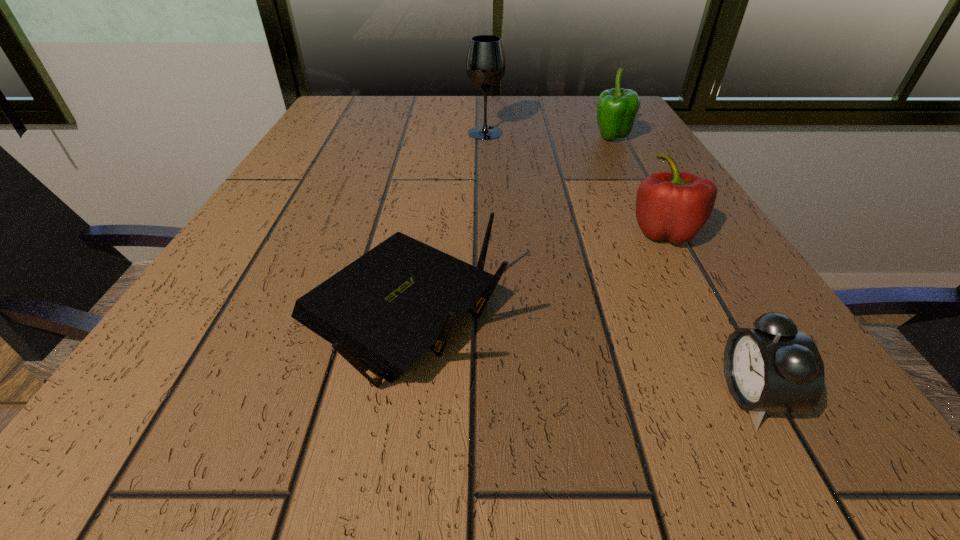
This screenshot has height=540, width=960. I want to click on object identified as the closest to the alarm clock, so click(675, 206).

This screenshot has width=960, height=540. In order to click on free space in the image that satisfies the following two spatial constraints: 1. on the back side of the second tallest object; 2. on the left side of the router in this screenshot , I will do `click(432, 139)`.

The height and width of the screenshot is (540, 960). Find the location of `vacant area that satisfies the following two spatial constraints: 1. on the front side of the tallest object; 2. on the right side of the fourth shortest object`. vacant area that satisfies the following two spatial constraints: 1. on the front side of the tallest object; 2. on the right side of the fourth shortest object is located at coordinates (486, 139).